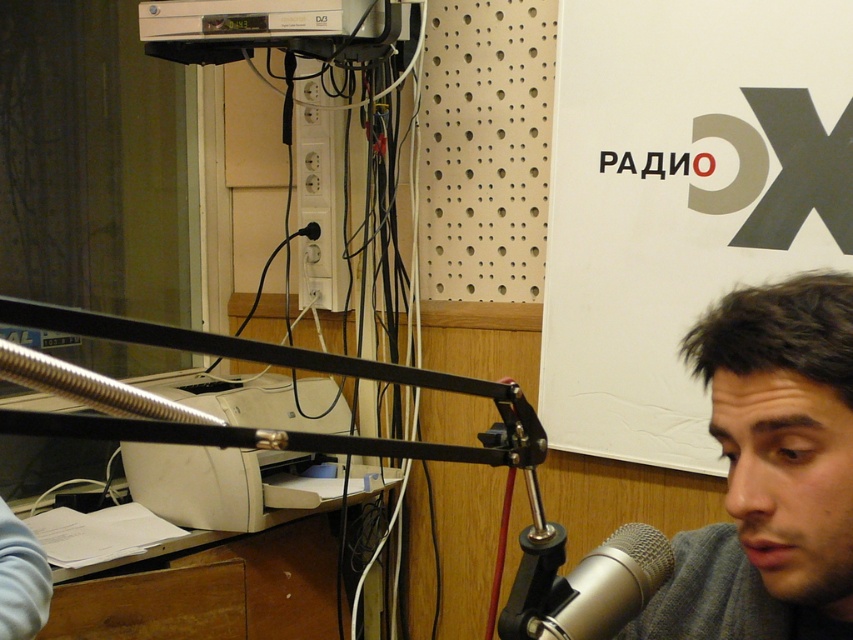
You are a technician in a radio studio. You need to place a new microphone stand that is 4 feet tall. The stand must be positioned so that it doesn not block the white paperboard at upper center. Based on the scene description, can you safely place the stand without obstructing the paperboard?

The white paperboard at upper center is 5.09 feet away from the camera. Since the microphone stand is only 4 feet tall, it will not reach the height of the paperboard and therefore will not block it. The stand can be safely placed without obstruction.

You are a technician in the studio and need to adjust the microphone stand. The gray fabric at lower right is part of the host chair. If you move the silver metallic microphone at center 3 inches closer to the chair, will it still be within the 6 inches safety distance required for equipment placement?

The gray fabric at lower right and silver metallic microphone at center are 5.67 inches apart. Moving the microphone 3 inches closer would reduce the distance to 2.67 inches, which is within the 6 inches safety distance. However, this might be too close for practical use, but technically meets the requirement.

You are a guest in the radio studio and need to sit down. There is a gray fabric at lower right and a silver metallic microphone at center. Which object can you sit on?

The gray fabric at lower right has a larger size compared to the silver metallic microphone at center, so you can sit on the gray fabric at lower right.